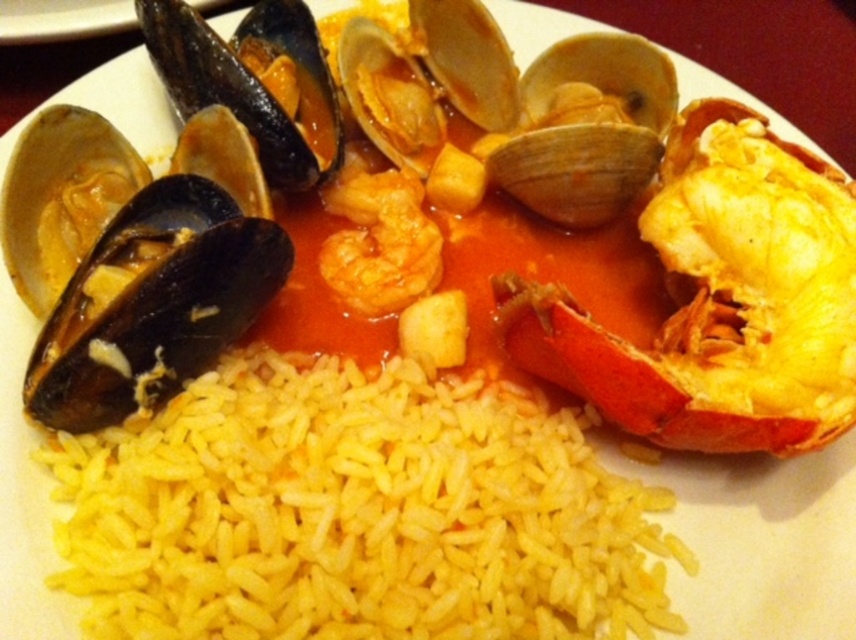
Who is taller, yellow polished rice at center or black matte mussel at left?

yellow polished rice at center is taller.

Is yellow polished rice at center closer to the viewer compared to black matte mussel at left?

That is True.

Does point (88, 483) come farther from viewer compared to point (63, 300)?

No, it is not.

Find the location of a particular element. yellow polished rice at center is located at coordinates (355, 513).

Can you confirm if black matte mussel at left is positioned to the left of orange glossy shrimp at center?

Yes, black matte mussel at left is to the left of orange glossy shrimp at center.

Does point (64, 388) come farther from viewer compared to point (343, 170)?

No, it is in front of (343, 170).

Describe the element at coordinates (156, 305) in the screenshot. I see `black matte mussel at left` at that location.

Locate an element on the screen. This screenshot has height=640, width=856. black matte mussel at left is located at coordinates (156, 305).

Which is more to the left, yellow polished rice at center or orange glossy shrimp at center?

orange glossy shrimp at center is more to the left.

Does yellow polished rice at center appear under orange glossy shrimp at center?

Correct, yellow polished rice at center is located below orange glossy shrimp at center.

Is point (462, 492) positioned behind point (339, 282)?

No, (462, 492) is in front of (339, 282).

Image resolution: width=856 pixels, height=640 pixels. Find the location of `yellow polished rice at center`. yellow polished rice at center is located at coordinates (355, 513).